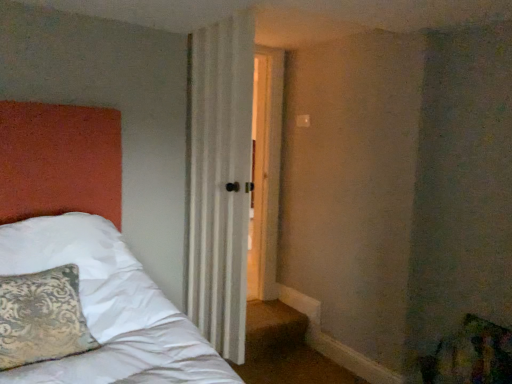
Describe the element at coordinates (42, 317) in the screenshot. Image resolution: width=512 pixels, height=384 pixels. I see `patterned fabric pillow at left` at that location.

This screenshot has height=384, width=512. Identify the location of patterned fabric pillow at left. click(x=42, y=317).

What do you see at coordinates (220, 180) in the screenshot?
I see `white sheer curtain at center` at bounding box center [220, 180].

This screenshot has height=384, width=512. Identify the location of white sheer curtain at center. (220, 180).

Locate an element on the screen. patterned fabric pillow at left is located at coordinates (42, 317).

Which object is positioned more to the right, patterned fabric pillow at left or white sheer curtain at center?

From the viewer's perspective, white sheer curtain at center appears more on the right side.

Does patterned fabric pillow at left come in front of white sheer curtain at center?

Yes, it is.

Does point (38, 332) come closer to viewer compared to point (244, 156)?

Yes, it is.

From the image's perspective, relative to white sheer curtain at center, is patterned fabric pillow at left above or below?

Based on their image positions, patterned fabric pillow at left is located beneath white sheer curtain at center.

Based on the photo, from a real-world perspective, is patterned fabric pillow at left positioned above or below white sheer curtain at center?

patterned fabric pillow at left is situated lower than white sheer curtain at center in the real world.

Based on the photo, considering the sizes of patterned fabric pillow at left and white sheer curtain at center in the image, is patterned fabric pillow at left wider or thinner than white sheer curtain at center?

Clearly, patterned fabric pillow at left has more width compared to white sheer curtain at center.

Does patterned fabric pillow at left have a lesser height compared to white sheer curtain at center?

Yes.

Between patterned fabric pillow at left and white sheer curtain at center, which one has larger size?

white sheer curtain at center is bigger.

Is white sheer curtain at center inside patterned fabric pillow at left?

No, white sheer curtain at center is not inside patterned fabric pillow at left.

Is patterned fabric pillow at left directly adjacent to white sheer curtain at center?

No.

In the scene shown: Does patterned fabric pillow at left turn towards white sheer curtain at center?

No, patterned fabric pillow at left does not turn towards white sheer curtain at center.

Can you tell me how much patterned fabric pillow at left and white sheer curtain at center differ in facing direction?

The facing directions of patterned fabric pillow at left and white sheer curtain at center are 84.1 degrees apart.

Measure the distance between patterned fabric pillow at left and white sheer curtain at center.

patterned fabric pillow at left is 1.05 meters away from white sheer curtain at center.

Find the location of a particular element. Image resolution: width=512 pixels, height=384 pixels. pillow that is in front of the white sheer curtain at center is located at coordinates (42, 317).

Considering the positions of objects white sheer curtain at center and patterned fabric pillow at left in the image provided, who is more to the right, white sheer curtain at center or patterned fabric pillow at left?

Positioned to the right is white sheer curtain at center.

Is the position of white sheer curtain at center more distant than that of patterned fabric pillow at left?

Yes, white sheer curtain at center is behind patterned fabric pillow at left.

Is point (224, 186) closer or farther from the camera than point (67, 347)?

Clearly, point (224, 186) is more distant from the camera than point (67, 347).

From the image's perspective, is white sheer curtain at center positioned above or below patterned fabric pillow at left?

From the image's perspective, white sheer curtain at center appears above patterned fabric pillow at left.

From a real-world perspective, is white sheer curtain at center on patterned fabric pillow at left?

Yes, from a real-world perspective, white sheer curtain at center is above patterned fabric pillow at left.

In terms of width, does white sheer curtain at center look wider or thinner when compared to patterned fabric pillow at left?

Considering their sizes, white sheer curtain at center looks slimmer than patterned fabric pillow at left.

Is white sheer curtain at center taller or shorter than patterned fabric pillow at left?

white sheer curtain at center is taller than patterned fabric pillow at left.

Which of these two, white sheer curtain at center or patterned fabric pillow at left, is smaller?

Smaller between the two is patterned fabric pillow at left.

Is white sheer curtain at center outside of patterned fabric pillow at left?

Yes, white sheer curtain at center is located beyond the bounds of patterned fabric pillow at left.

Is there a large distance between white sheer curtain at center and patterned fabric pillow at left?

white sheer curtain at center is far away from patterned fabric pillow at left.

Is white sheer curtain at center facing towards patterned fabric pillow at left?

Yes, white sheer curtain at center is facing patterned fabric pillow at left.

Can you tell me how much white sheer curtain at center and patterned fabric pillow at left differ in facing direction?

The angular difference between white sheer curtain at center and patterned fabric pillow at left is 84.1 degrees.

You are a GUI agent. You are given a task and a screenshot of the screen. Output one action in this format:
    pyautogui.click(x=<x>, y=<y>)
    Task: Click on the pillow in front of the white sheer curtain at center
    This screenshot has width=512, height=384.
    Given the screenshot: What is the action you would take?
    pyautogui.click(x=42, y=317)

This screenshot has width=512, height=384. Find the location of `pillow that is in front of the white sheer curtain at center`. pillow that is in front of the white sheer curtain at center is located at coordinates (42, 317).

Identify the location of curtain above the patterned fabric pillow at left (from the image's perspective). pyautogui.click(x=220, y=180).